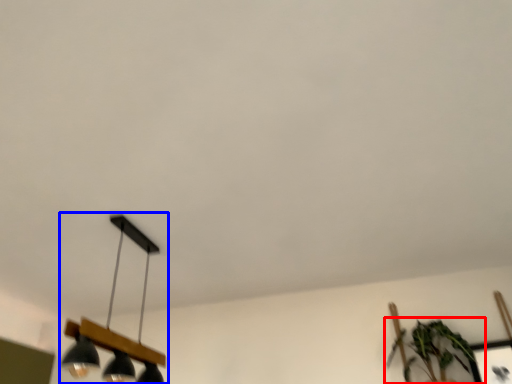
Question: Which object appears closest to the camera in this image, houseplant (highlighted by a red box) or lamp (highlighted by a blue box)?

Choices:
 (A) houseplant
 (B) lamp

Answer: (B)